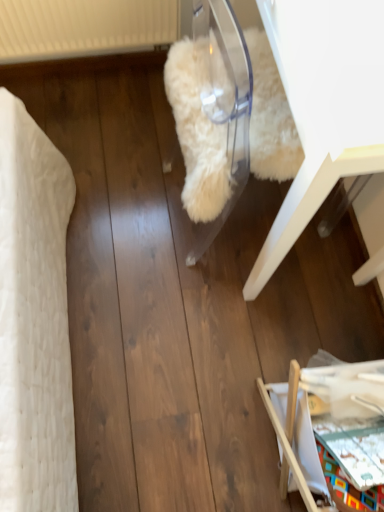
Describe the element at coordinates (324, 106) in the screenshot. I see `white fluffy rug at center, placed as the second furniture when sorted from bottom to top` at that location.

What are the coordinates of `white fluffy rug at center, placed as the second furniture when sorted from bottom to top` in the screenshot? It's located at (324, 106).

This screenshot has width=384, height=512. What do you see at coordinates (298, 414) in the screenshot?
I see `wooden folding chair at lower right, which appears as the second furniture when viewed from the top` at bounding box center [298, 414].

The width and height of the screenshot is (384, 512). In order to click on wooden folding chair at lower right, which appears as the second furniture when viewed from the top in this screenshot , I will do `click(298, 414)`.

How much space does wooden folding chair at lower right, which appears as the second furniture when viewed from the top, occupy vertically?

The height of wooden folding chair at lower right, which appears as the second furniture when viewed from the top, is 14.04 inches.

At what (x,y) coordinates should I click in order to perform the action: click on white fluffy rug at center, placed as the second furniture when sorted from bottom to top. Please return your answer as a coordinate pair (x, y). Image resolution: width=384 pixels, height=512 pixels. Looking at the image, I should click on (324, 106).

Consider the image. Is white fluffy rug at center, acting as the first furniture starting from the top, to the left or to the right of wooden folding chair at lower right, which appears as the second furniture when viewed from the top, in the image?

Clearly, white fluffy rug at center, acting as the first furniture starting from the top, is on the left of wooden folding chair at lower right, which appears as the second furniture when viewed from the top, in the image.

Relative to wooden folding chair at lower right, marked as the first furniture in a bottom-to-top arrangement, is white fluffy rug at center, acting as the first furniture starting from the top, in front or behind?

In the image, white fluffy rug at center, acting as the first furniture starting from the top, appears in front of wooden folding chair at lower right, marked as the first furniture in a bottom-to-top arrangement.

Between point (374, 122) and point (294, 463), which one is positioned in front?

The point (374, 122) is more forward.

From the image's perspective, is white fluffy rug at center, placed as the second furniture when sorted from bottom to top, on top of wooden folding chair at lower right, which appears as the second furniture when viewed from the top?

Yes.

From a real-world perspective, is white fluffy rug at center, placed as the second furniture when sorted from bottom to top, positioned under wooden folding chair at lower right, marked as the first furniture in a bottom-to-top arrangement, based on gravity?

Incorrect, from a real-world perspective, white fluffy rug at center, placed as the second furniture when sorted from bottom to top, is higher than wooden folding chair at lower right, marked as the first furniture in a bottom-to-top arrangement.

Considering the relative sizes of white fluffy rug at center, acting as the first furniture starting from the top, and wooden folding chair at lower right, which appears as the second furniture when viewed from the top, in the image provided, is white fluffy rug at center, acting as the first furniture starting from the top, wider than wooden folding chair at lower right, which appears as the second furniture when viewed from the top,?

No, white fluffy rug at center, acting as the first furniture starting from the top, is not wider than wooden folding chair at lower right, which appears as the second furniture when viewed from the top.

Between white fluffy rug at center, placed as the second furniture when sorted from bottom to top, and wooden folding chair at lower right, which appears as the second furniture when viewed from the top, which one has more height?

Standing taller between the two is white fluffy rug at center, placed as the second furniture when sorted from bottom to top.

Is white fluffy rug at center, acting as the first furniture starting from the top, smaller than wooden folding chair at lower right, which appears as the second furniture when viewed from the top?

Incorrect, white fluffy rug at center, acting as the first furniture starting from the top, is not smaller in size than wooden folding chair at lower right, which appears as the second furniture when viewed from the top.

Could wooden folding chair at lower right, which appears as the second furniture when viewed from the top, be considered to be inside white fluffy rug at center, acting as the first furniture starting from the top?

No.

Is white fluffy rug at center, acting as the first furniture starting from the top, directly adjacent to wooden folding chair at lower right, marked as the first furniture in a bottom-to-top arrangement?

No, white fluffy rug at center, acting as the first furniture starting from the top, is not touching wooden folding chair at lower right, marked as the first furniture in a bottom-to-top arrangement.

Is white fluffy rug at center, acting as the first furniture starting from the top, facing towards wooden folding chair at lower right, which appears as the second furniture when viewed from the top?

No, white fluffy rug at center, acting as the first furniture starting from the top, is not facing towards wooden folding chair at lower right, which appears as the second furniture when viewed from the top.

Identify the location of furniture located underneath the white fluffy rug at center, placed as the second furniture when sorted from bottom to top (from a real-world perspective). Image resolution: width=384 pixels, height=512 pixels. (298, 414).

Between wooden folding chair at lower right, which appears as the second furniture when viewed from the top, and white fluffy rug at center, acting as the first furniture starting from the top, which one appears on the right side from the viewer's perspective?

wooden folding chair at lower right, which appears as the second furniture when viewed from the top.

Which object is closer to the camera, wooden folding chair at lower right, which appears as the second furniture when viewed from the top, or white fluffy rug at center, acting as the first furniture starting from the top?

Positioned in front is white fluffy rug at center, acting as the first furniture starting from the top.

Between point (293, 433) and point (347, 157), which one is positioned in front?

Positioned in front is point (347, 157).

From the image's perspective, which is above, wooden folding chair at lower right, which appears as the second furniture when viewed from the top, or white fluffy rug at center, acting as the first furniture starting from the top?

white fluffy rug at center, acting as the first furniture starting from the top, appears higher in the image.

From a real-world perspective, does wooden folding chair at lower right, which appears as the second furniture when viewed from the top, sit lower than white fluffy rug at center, placed as the second furniture when sorted from bottom to top?

Yes, from a real-world perspective, wooden folding chair at lower right, which appears as the second furniture when viewed from the top, is beneath white fluffy rug at center, placed as the second furniture when sorted from bottom to top.

Between wooden folding chair at lower right, which appears as the second furniture when viewed from the top, and white fluffy rug at center, placed as the second furniture when sorted from bottom to top, which one has smaller width?

white fluffy rug at center, placed as the second furniture when sorted from bottom to top.

Considering the sizes of wooden folding chair at lower right, which appears as the second furniture when viewed from the top, and white fluffy rug at center, acting as the first furniture starting from the top, in the image, is wooden folding chair at lower right, which appears as the second furniture when viewed from the top, taller or shorter than white fluffy rug at center, acting as the first furniture starting from the top,?

wooden folding chair at lower right, which appears as the second furniture when viewed from the top, is shorter than white fluffy rug at center, acting as the first furniture starting from the top.

Can you confirm if wooden folding chair at lower right, marked as the first furniture in a bottom-to-top arrangement, is smaller than white fluffy rug at center, placed as the second furniture when sorted from bottom to top?

Yes.

Can we say wooden folding chair at lower right, which appears as the second furniture when viewed from the top, lies outside white fluffy rug at center, acting as the first furniture starting from the top?

That's correct, wooden folding chair at lower right, which appears as the second furniture when viewed from the top, is outside of white fluffy rug at center, acting as the first furniture starting from the top.

Is wooden folding chair at lower right, which appears as the second furniture when viewed from the top, next to white fluffy rug at center, placed as the second furniture when sorted from bottom to top, and touching it?

No, wooden folding chair at lower right, which appears as the second furniture when viewed from the top, is not touching white fluffy rug at center, placed as the second furniture when sorted from bottom to top.

Is wooden folding chair at lower right, which appears as the second furniture when viewed from the top, aimed at white fluffy rug at center, placed as the second furniture when sorted from bottom to top?

No, wooden folding chair at lower right, which appears as the second furniture when viewed from the top, is not facing towards white fluffy rug at center, placed as the second furniture when sorted from bottom to top.

How different are the orientations of wooden folding chair at lower right, which appears as the second furniture when viewed from the top, and white fluffy rug at center, placed as the second furniture when sorted from bottom to top, in degrees?

There is a 0.00817-degree angle between the facing directions of wooden folding chair at lower right, which appears as the second furniture when viewed from the top, and white fluffy rug at center, placed as the second furniture when sorted from bottom to top.

Measure the distance from wooden folding chair at lower right, marked as the first furniture in a bottom-to-top arrangement, to white fluffy rug at center, placed as the second furniture when sorted from bottom to top.

wooden folding chair at lower right, marked as the first furniture in a bottom-to-top arrangement, and white fluffy rug at center, placed as the second furniture when sorted from bottom to top, are 43.63 centimeters apart from each other.

At what (x,y) coordinates should I click in order to perform the action: click on furniture below the white fluffy rug at center, acting as the first furniture starting from the top (from the image's perspective). Please return your answer as a coordinate pair (x, y). The image size is (384, 512). Looking at the image, I should click on (298, 414).

The height and width of the screenshot is (512, 384). I want to click on furniture above the wooden folding chair at lower right, which appears as the second furniture when viewed from the top (from the image's perspective), so coord(324,106).

Where is `furniture that appears on the left of wooden folding chair at lower right, marked as the first furniture in a bottom-to-top arrangement`? furniture that appears on the left of wooden folding chair at lower right, marked as the first furniture in a bottom-to-top arrangement is located at coordinates (324, 106).